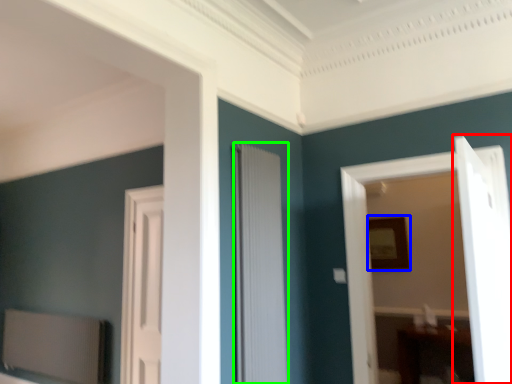
Question: Considering the real-world distances, which object is closest to door (highlighted by a red box)? picture frame (highlighted by a blue box) or door (highlighted by a green box).

Choices:
 (A) picture frame
 (B) door

Answer: (B)